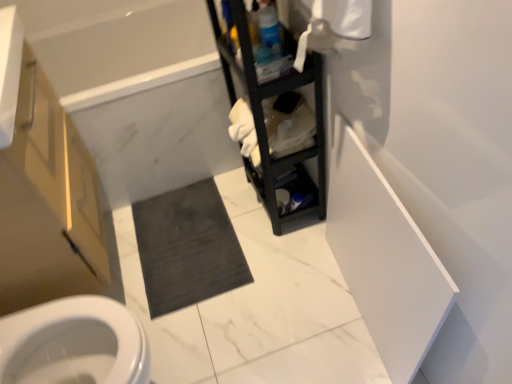
Question: Would you say black matte shelf at center is outside white marble bathtub at upper left?

Choices:
 (A) yes
 (B) no

Answer: (A)

Question: Is black matte shelf at center in contact with white marble bathtub at upper left?

Choices:
 (A) no
 (B) yes

Answer: (A)

Question: Is the depth of black matte shelf at center greater than that of white marble bathtub at upper left?

Choices:
 (A) yes
 (B) no

Answer: (B)

Question: Is white marble bathtub at upper left located within black matte shelf at center?

Choices:
 (A) no
 (B) yes

Answer: (A)

Question: Is black matte shelf at center not close to white marble bathtub at upper left?

Choices:
 (A) yes
 (B) no

Answer: (B)

Question: Does black matte shelf at center have a larger size compared to white marble bathtub at upper left?

Choices:
 (A) yes
 (B) no

Answer: (B)

Question: Is white marble bathtub at upper left not inside dark gray carpet at center?

Choices:
 (A) no
 (B) yes

Answer: (B)

Question: Can you confirm if white marble bathtub at upper left is shorter than dark gray carpet at center?

Choices:
 (A) no
 (B) yes

Answer: (A)

Question: Is dark gray carpet at center at the back of white marble bathtub at upper left?

Choices:
 (A) no
 (B) yes

Answer: (A)

Question: Is white marble bathtub at upper left aimed at dark gray carpet at center?

Choices:
 (A) yes
 (B) no

Answer: (A)

Question: Is white marble bathtub at upper left wider than dark gray carpet at center?

Choices:
 (A) yes
 (B) no

Answer: (A)

Question: Is white marble bathtub at upper left behind dark gray carpet at center?

Choices:
 (A) yes
 (B) no

Answer: (B)

Question: Does dark gray carpet at center have a larger size compared to matte wood cabinet at left?

Choices:
 (A) yes
 (B) no

Answer: (B)